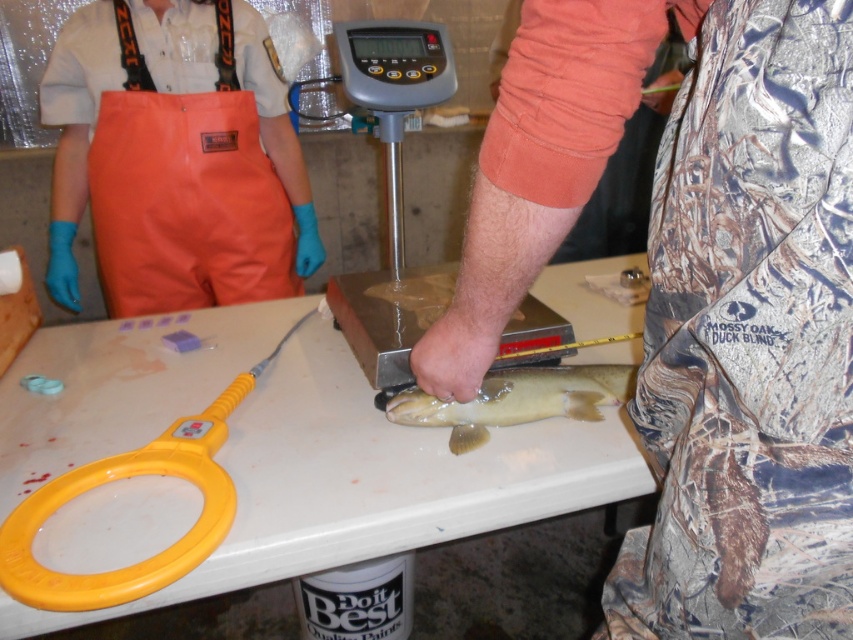
Consider the image. You are a judge at a fishing competition and need to verify the height of the camouflage fabric pants at lower right and the shiny brown fish at center. Which object is taller?

The camouflage fabric pants at lower right is much taller than the shiny brown fish at center.

You need to place the yellow plastic scissors at lower left on the white plastic table at center. Will the scissors fit on the table?

The white plastic table at center is bigger than yellow plastic scissors at lower left, so yes, the scissors will fit on the table.

You are standing at the center of the image. Which direction should you move to reach the camouflage fabric pants at lower right?

You should move towards the lower right direction to reach the camouflage fabric pants at lower right since it is located at point (698, 294) in the image.